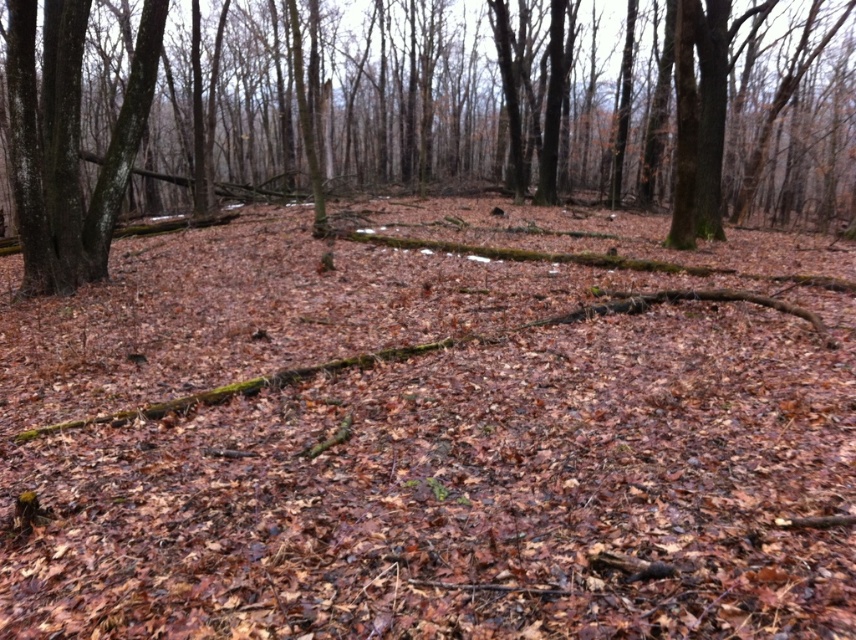
You are a hiker trying to navigate through the forest. You see a brown bark tree at center and a smooth bark tree at left. Which tree would block your view more if you were walking towards them?

The brown bark tree at center is in front of the smooth bark tree at left, so it would block your view more as you walk towards them.

You are standing in the forest and want to walk from point A to point B. Point A is at coordinate (471, 144) and point B is at coordinate (52, 196). Which direction should you move to get closer to point B?

To move from point A at coordinate (471, 144) to point B at coordinate (52, 196), you should move downward and to the right since point B is located lower and to the right of point A.

You are a hiker trying to navigate through the forest. You notice two trees ahead of you, the brown bark tree at center and the smooth bark tree at left. Which tree should you approach if you want to find a higher vantage point?

The brown bark tree at center is taller than the smooth bark tree at left, so approaching the brown bark tree at center would provide a higher vantage point.